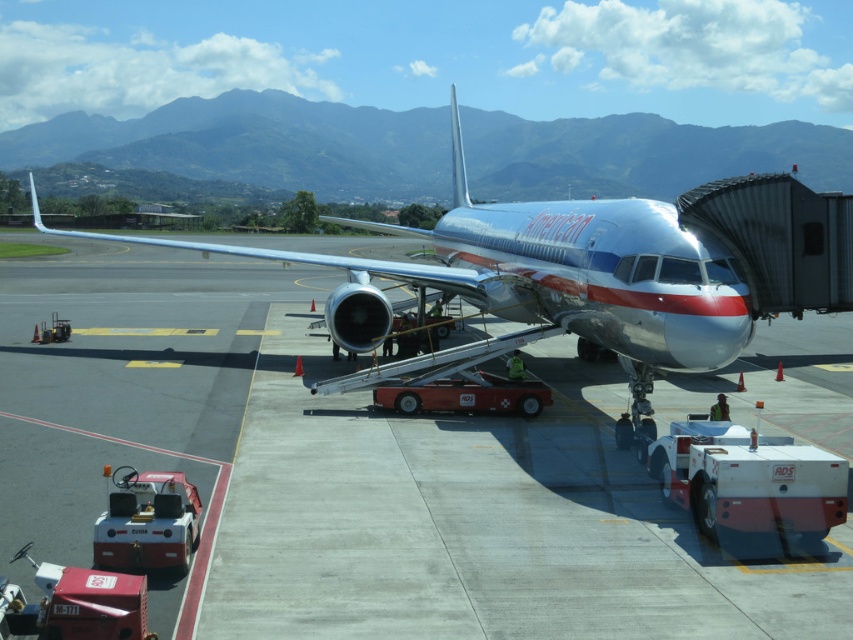
Question: Does smooth concrete tarmac at center appear on the left side of silver metallic airplane at center?

Choices:
 (A) no
 (B) yes

Answer: (A)

Question: Is smooth concrete tarmac at center positioned before silver metallic airplane at center?

Choices:
 (A) no
 (B) yes

Answer: (B)

Question: Which point is closer to the camera taking this photo?

Choices:
 (A) (78, 472)
 (B) (596, 330)

Answer: (A)

Question: Which object is closer to the camera taking this photo?

Choices:
 (A) silver metallic airplane at center
 (B) smooth concrete tarmac at center

Answer: (B)

Question: Which point is closer to the camera taking this photo?

Choices:
 (A) (155, 406)
 (B) (556, 294)

Answer: (A)

Question: Does smooth concrete tarmac at center appear under silver metallic airplane at center?

Choices:
 (A) no
 (B) yes

Answer: (B)